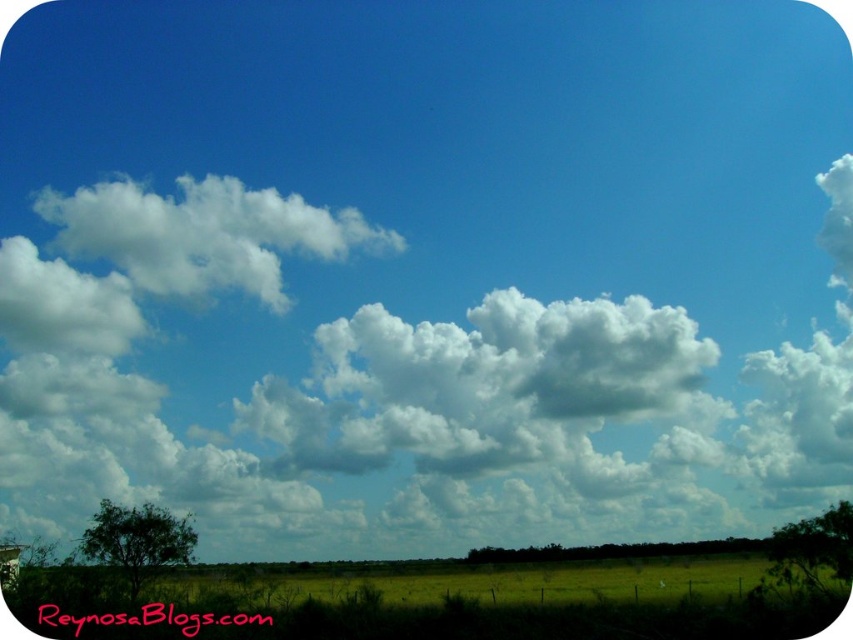
Question: Can you confirm if white fluffy cloud at upper left is thinner than green grass at lower center?

Choices:
 (A) no
 (B) yes

Answer: (B)

Question: Which point is closer to the camera?

Choices:
 (A) (737, 560)
 (B) (247, 282)

Answer: (A)

Question: Which point appears farthest from the camera in this image?

Choices:
 (A) (136, 230)
 (B) (627, 572)

Answer: (A)

Question: Is white fluffy cloud at upper left above green grass at lower center?

Choices:
 (A) no
 (B) yes

Answer: (B)

Question: Does white fluffy cloud at upper left appear on the left side of green grass at lower center?

Choices:
 (A) yes
 (B) no

Answer: (A)